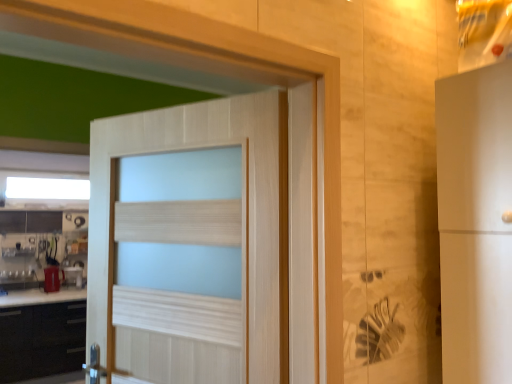
The width and height of the screenshot is (512, 384). What do you see at coordinates (73, 275) in the screenshot?
I see `matte red cup at lower left, which is counted as the first appliance, starting from the back` at bounding box center [73, 275].

The width and height of the screenshot is (512, 384). Identify the location of black matte cabinet at lower left. (41, 340).

Measure the distance between point (40,369) and camera.

Point (40,369) and camera are 13.40 feet apart.

The width and height of the screenshot is (512, 384). Describe the element at coordinates (191, 242) in the screenshot. I see `light wood door at center` at that location.

What do you see at coordinates (51, 279) in the screenshot? Image resolution: width=512 pixels, height=384 pixels. I see `metallic silver kettle at left, the first appliance from the front` at bounding box center [51, 279].

At what (x,y) coordinates should I click in order to perform the action: click on matte red cup at lower left, which ranks as the 2th appliance in front-to-back order. Please return your answer as a coordinate pair (x, y). This screenshot has width=512, height=384. Looking at the image, I should click on (73, 275).

Is the position of matte red cup at lower left, which is counted as the first appliance, starting from the back, less distant than that of metallic silver kettle at left, the first appliance from the front?

No, matte red cup at lower left, which is counted as the first appliance, starting from the back, is further to the viewer.

Does point (70, 273) appear closer or farther from the camera than point (52, 279)?

Point (70, 273) appears to be farther away from the viewer than point (52, 279).

Is matte red cup at lower left, which ranks as the 2th appliance in front-to-back order, turned away from metallic silver kettle at left, which is the second appliance in back-to-front order?

No, matte red cup at lower left, which ranks as the 2th appliance in front-to-back order,'s orientation is not away from metallic silver kettle at left, which is the second appliance in back-to-front order.

Choose the correct answer: Is matte red cup at lower left, which ranks as the 2th appliance in front-to-back order, inside metallic silver kettle at left, the first appliance from the front, or outside it?

matte red cup at lower left, which ranks as the 2th appliance in front-to-back order, is spatially situated outside metallic silver kettle at left, the first appliance from the front.

In terms of width, does metallic silver kettle at left, which is the second appliance in back-to-front order, look wider or thinner when compared to white frosted glass window at upper center?

metallic silver kettle at left, which is the second appliance in back-to-front order, is wider than white frosted glass window at upper center.

Considering the positions of objects metallic silver kettle at left, which is the second appliance in back-to-front order, and white frosted glass window at upper center in the image provided, who is more to the left, metallic silver kettle at left, which is the second appliance in back-to-front order, or white frosted glass window at upper center?

white frosted glass window at upper center is more to the left.

Which is in front, point (53, 269) or point (16, 193)?

The point (53, 269) is closer.

Between metallic silver kettle at left, the first appliance from the front, and white frosted glass window at upper center, which one has smaller size?

With smaller size is metallic silver kettle at left, the first appliance from the front.

Which object is positioned more to the left, light wood door at center or metallic silver kettle at left, which is the second appliance in back-to-front order?

Positioned to the left is metallic silver kettle at left, which is the second appliance in back-to-front order.

Which is behind, point (139, 361) or point (45, 289)?

Point (45, 289)

Looking at this image, which object is thinner, light wood door at center or metallic silver kettle at left, the first appliance from the front?

Thinner between the two is light wood door at center.

Does point (28, 179) lie in front of point (65, 359)?

No.

Would you say white frosted glass window at upper center is outside black matte cabinet at lower left?

Yes.

Is matte red cup at lower left, which is counted as the first appliance, starting from the back, positioned with its back to white frosted glass window at upper center?

No, white frosted glass window at upper center is not at the back of matte red cup at lower left, which is counted as the first appliance, starting from the back.

Is matte red cup at lower left, which is counted as the first appliance, starting from the back, bigger than white frosted glass window at upper center?

No, matte red cup at lower left, which is counted as the first appliance, starting from the back, is not bigger than white frosted glass window at upper center.

Considering the positions of points (77, 268) and (20, 192), is point (77, 268) farther from camera compared to point (20, 192)?

No, it is in front of (20, 192).

Which object is wider, matte red cup at lower left, which is counted as the first appliance, starting from the back, or white frosted glass window at upper center?

With larger width is matte red cup at lower left, which is counted as the first appliance, starting from the back.

Is white frosted glass window at upper center aimed at metallic silver kettle at left, the first appliance from the front?

No, white frosted glass window at upper center is not facing towards metallic silver kettle at left, the first appliance from the front.

From the picture: Which is behind, white frosted glass window at upper center or metallic silver kettle at left, the first appliance from the front?

Positioned behind is white frosted glass window at upper center.

At what (x,y) coordinates should I click in order to perform the action: click on appliance that is in front of the white frosted glass window at upper center. Please return your answer as a coordinate pair (x, y). Image resolution: width=512 pixels, height=384 pixels. Looking at the image, I should click on (51, 279).

Find the location of a particular element. door in front of the black matte cabinet at lower left is located at coordinates (191, 242).

From the image's perspective, is black matte cabinet at lower left beneath light wood door at center?

Correct, black matte cabinet at lower left appears lower than light wood door at center in the image.

Is black matte cabinet at lower left in contact with light wood door at center?

No, black matte cabinet at lower left is not with light wood door at center.

Is black matte cabinet at lower left to the left of light wood door at center from the viewer's perspective?

Yes.

You are a GUI agent. You are given a task and a screenshot of the screen. Output one action in this format:
    pyautogui.click(x=<x>, y=<y>)
    Task: Click on the appliance that is on the right side of metallic silver kettle at left, which is the second appliance in back-to-front order
    The height and width of the screenshot is (384, 512).
    Given the screenshot: What is the action you would take?
    pyautogui.click(x=73, y=275)

From a real-world perspective, starting from the white frosted glass window at upper center, which appliance is the 1st one below it? Please provide its 2D coordinates.

[(51, 279)]

From the image, which object appears to be farther from white frosted glass window at upper center, metallic silver kettle at left, which is the second appliance in back-to-front order, or light wood door at center?

light wood door at center.

From the image, which object appears to be nearer to matte red cup at lower left, which ranks as the 2th appliance in front-to-back order, metallic silver kettle at left, the first appliance from the front, or white frosted glass window at upper center?

The object closer to matte red cup at lower left, which ranks as the 2th appliance in front-to-back order, is metallic silver kettle at left, the first appliance from the front.

From the image, which object appears to be farther from black matte cabinet at lower left, light wood door at center or white frosted glass window at upper center?

light wood door at center lies further to black matte cabinet at lower left than the other object.

From the image, which object appears to be farther from metallic silver kettle at left, which is the second appliance in back-to-front order, white frosted glass window at upper center or black matte cabinet at lower left?

white frosted glass window at upper center is positioned further to the anchor metallic silver kettle at left, which is the second appliance in back-to-front order.

From the image, which object appears to be nearer to black matte cabinet at lower left, white frosted glass window at upper center or metallic silver kettle at left, the first appliance from the front?

Based on the image, metallic silver kettle at left, the first appliance from the front, appears to be nearer to black matte cabinet at lower left.

From the image, which object appears to be farther from metallic silver kettle at left, which is the second appliance in back-to-front order, matte red cup at lower left, which ranks as the 2th appliance in front-to-back order, or white frosted glass window at upper center?

white frosted glass window at upper center lies further to metallic silver kettle at left, which is the second appliance in back-to-front order, than the other object.

Based on their spatial positions, is metallic silver kettle at left, the first appliance from the front, or light wood door at center closer to matte red cup at lower left, which ranks as the 2th appliance in front-to-back order?

metallic silver kettle at left, the first appliance from the front, is positioned closer to the anchor matte red cup at lower left, which ranks as the 2th appliance in front-to-back order.

From the image, which object appears to be farther from matte red cup at lower left, which is counted as the first appliance, starting from the back, black matte cabinet at lower left or metallic silver kettle at left, which is the second appliance in back-to-front order?

Among the two, black matte cabinet at lower left is located further to matte red cup at lower left, which is counted as the first appliance, starting from the back.

Find the location of a particular element. This screenshot has height=384, width=512. cabinetry located between light wood door at center and metallic silver kettle at left, which is the second appliance in back-to-front order, in the depth direction is located at coordinates (41, 340).

Locate an element on the screen. The width and height of the screenshot is (512, 384). appliance between white frosted glass window at upper center and matte red cup at lower left, which ranks as the 2th appliance in front-to-back order, in the vertical direction is located at coordinates (51, 279).

Identify the location of appliance positioned between light wood door at center and matte red cup at lower left, which is counted as the first appliance, starting from the back, from near to far. This screenshot has width=512, height=384. (51, 279).

Where is `cabinetry located between light wood door at center and matte red cup at lower left, which ranks as the 2th appliance in front-to-back order, in the depth direction`? cabinetry located between light wood door at center and matte red cup at lower left, which ranks as the 2th appliance in front-to-back order, in the depth direction is located at coordinates (41, 340).